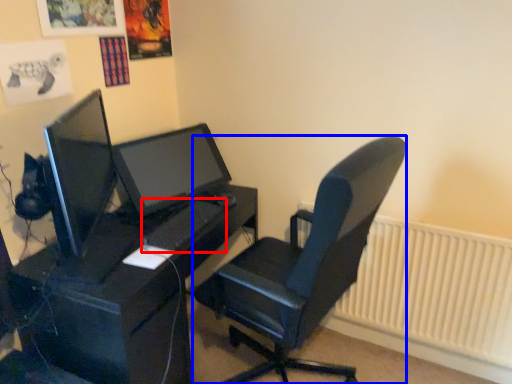
Question: Which point is further to the camera, keyboard (highlighted by a red box) or chair (highlighted by a blue box)?

Choices:
 (A) keyboard
 (B) chair

Answer: (A)